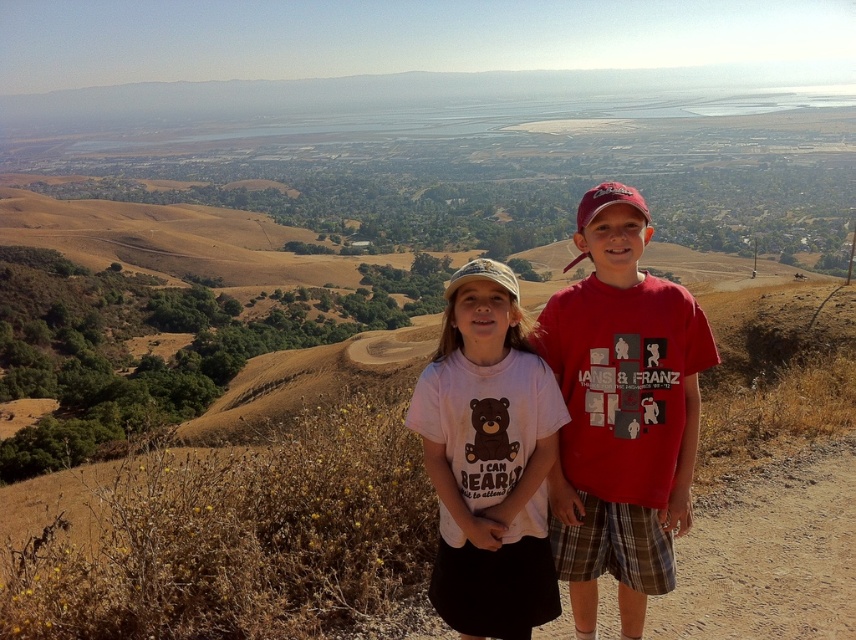
Question: Which object is closer to the camera taking this photo?

Choices:
 (A) white cotton shirt at center
 (B) matte red t-shirt at center

Answer: (A)

Question: Which point appears farthest from the camera in this image?

Choices:
 (A) click(x=617, y=467)
 (B) click(x=535, y=516)

Answer: (A)

Question: Among these points, which one is nearest to the camera?

Choices:
 (A) (484, 262)
 (B) (638, 417)

Answer: (A)

Question: Can you confirm if matte red t-shirt at center is positioned below white cotton shirt at center?

Choices:
 (A) yes
 (B) no

Answer: (B)

Question: Does matte red t-shirt at center have a lesser width compared to white cotton shirt at center?

Choices:
 (A) yes
 (B) no

Answer: (B)

Question: Can you confirm if matte red t-shirt at center is positioned above white cotton shirt at center?

Choices:
 (A) yes
 (B) no

Answer: (A)